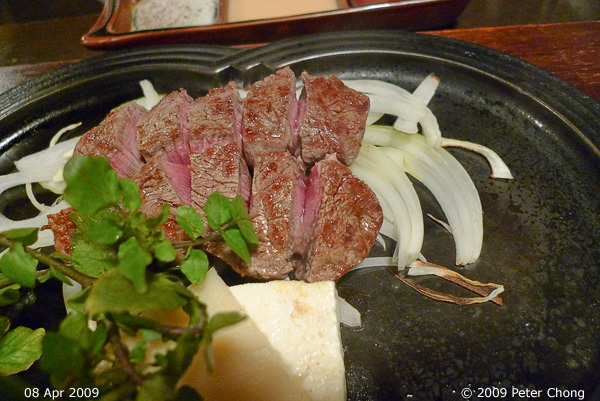
Find the location of a particular element. The height and width of the screenshot is (401, 600). empty table space is located at coordinates (576, 54).